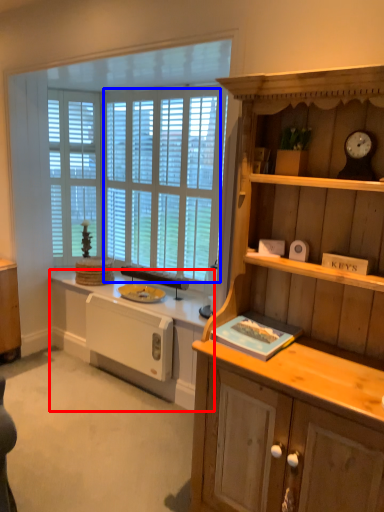
Question: Which object appears closest to the camera in this image, countertop (highlighted by a red box) or window screen (highlighted by a blue box)?

Choices:
 (A) countertop
 (B) window screen

Answer: (A)